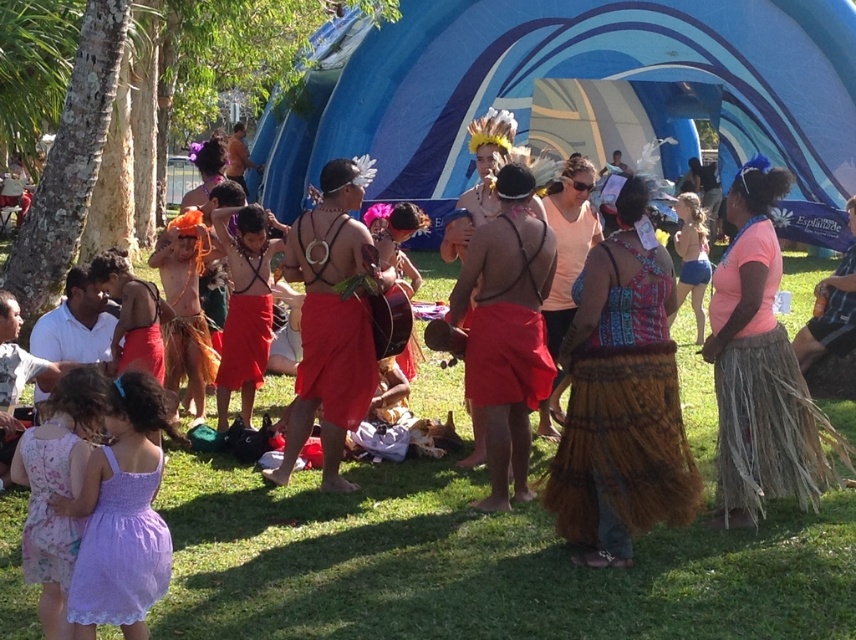
You are a photographer at the event and want to capture a photo that includes both the green grass at center and the lavender lace dress at lower left. Which object should you focus on first if you want to ensure both are in frame?

The green grass at center is larger in size compared to the lavender lace dress at lower left. To ensure both are in frame, focus on the larger green grass at center first, then adjust to include the smaller lavender lace dress at lower left.

You are a photographer trying to capture the performers at the center of the stage. You notice two skirts at the center of the image, a brown woven skirt at center and a red fabric skirt at center. Which one is positioned to the right side of the other?

The brown woven skirt at center is positioned to the right of the red fabric skirt at center.